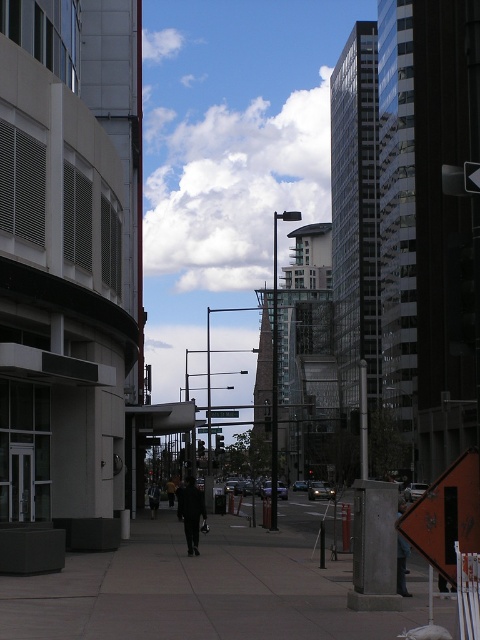
You are a delivery person carrying a package and need to place it on the metallic street sign at center. However, there is a dark gray jacket at lower right in the way. Can you place the package on the sign without moving the jacket?

The dark gray jacket at lower right is above the metallic street sign at center, so the jacket is blocking access to the sign. You would need to move the jacket to place the package on the sign.

You are a delivery person carrying a large package that requires a coat to protect it from the rain. You see a dark wool coat at center and a dark gray jacket at lower right. Which one should you choose to use as a makeshift cover for your package?

The dark wool coat at center is larger in size than the dark gray jacket at lower right, so you should choose the dark wool coat at center to use as a makeshift cover for your package.